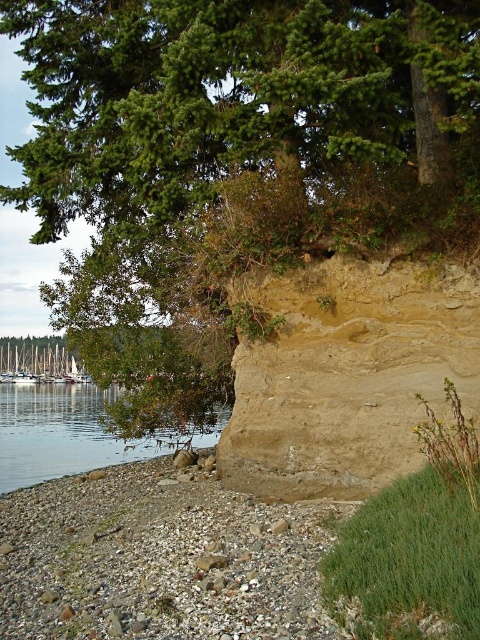
Question: Which point is closer to the camera?

Choices:
 (A) greenish water at lower left
 (B) brown sandy cliff at center
 (C) white wooden boats at lower left

Answer: (B)

Question: Which point is farther from the camera taking this photo?

Choices:
 (A) (38, 454)
 (B) (282, 332)
 (C) (60, 339)
 (D) (96, 339)

Answer: (C)

Question: Can you confirm if green leafy tree at upper left is positioned above greenish water at lower left?

Choices:
 (A) yes
 (B) no

Answer: (A)

Question: Is brown sandy cliff at center above greenish water at lower left?

Choices:
 (A) yes
 (B) no

Answer: (A)

Question: Which object is positioned farthest from the white wooden boats at lower left?

Choices:
 (A) brown sandy cliff at center
 (B) green leafy tree at upper left
 (C) greenish water at lower left

Answer: (B)

Question: From the image, what is the correct spatial relationship of brown sandy cliff at center in relation to white wooden boats at lower left?

Choices:
 (A) right
 (B) left

Answer: (A)